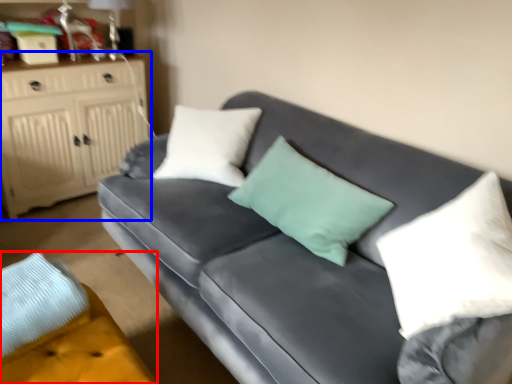
Question: Which object is closer to the camera taking this photo, footrest (highlighted by a red box) or cabinetry (highlighted by a blue box)?

Choices:
 (A) footrest
 (B) cabinetry

Answer: (A)